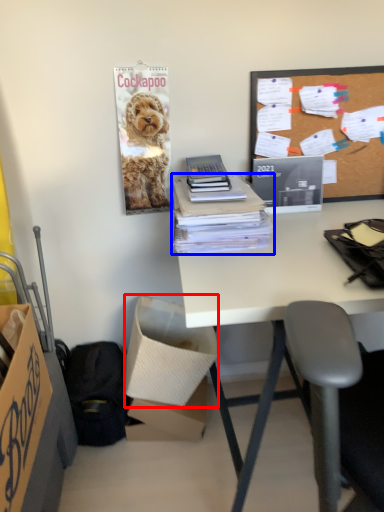
Question: Which object is closer to the camera taking this photo, box (highlighted by a red box) or office supplies (highlighted by a blue box)?

Choices:
 (A) box
 (B) office supplies

Answer: (B)